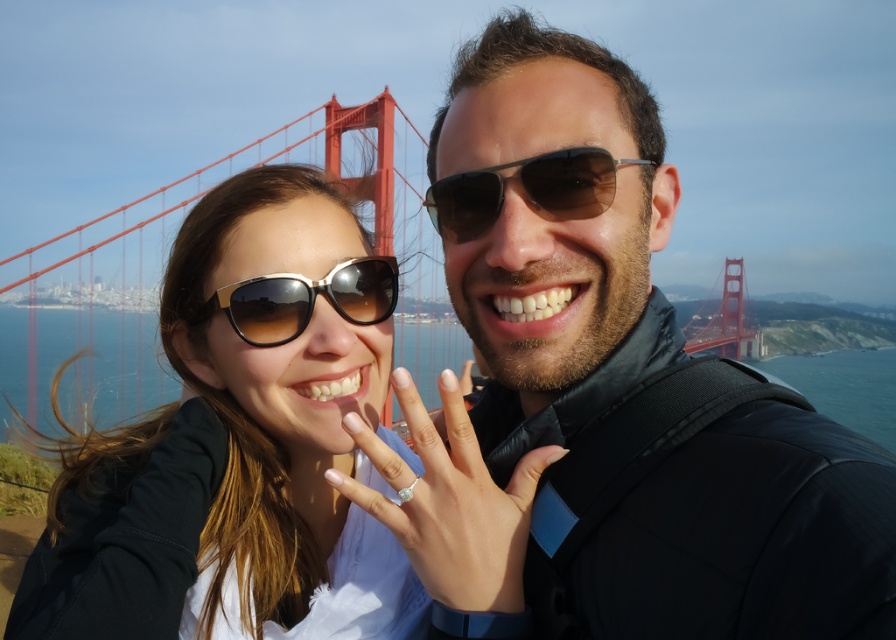
Which is behind, point (420, 560) or point (744, 339)?

Positioned behind is point (744, 339).

Does clear acrylic ring at center appear on the left side of red painted steel bridge at center?

Correct, you'll find clear acrylic ring at center to the left of red painted steel bridge at center.

The image size is (896, 640). What are the coordinates of `clear acrylic ring at center` in the screenshot? It's located at (455, 506).

Locate an element on the screen. clear acrylic ring at center is located at coordinates (455, 506).

Is point (539, 125) closer to camera compared to point (228, 250)?

That is True.

Can you confirm if matte black jacket at center is wider than matte black sunglasses at upper center?

No.

Who is more distant from viewer, (x=668, y=589) or (x=268, y=445)?

Point (x=268, y=445)

The height and width of the screenshot is (640, 896). Find the location of `matte black jacket at center`. matte black jacket at center is located at coordinates (607, 396).

Is point (466, 600) in front of point (380, 272)?

Yes, point (466, 600) is closer to viewer.

Who is shorter, clear acrylic ring at center or gold gradient plastic sunglasses at center?

gold gradient plastic sunglasses at center

Which is in front, point (515, 516) or point (354, 259)?

Point (515, 516) is more forward.

At what (x,y) coordinates should I click in order to perform the action: click on clear acrylic ring at center. Please return your answer as a coordinate pair (x, y). Looking at the image, I should click on (455, 506).